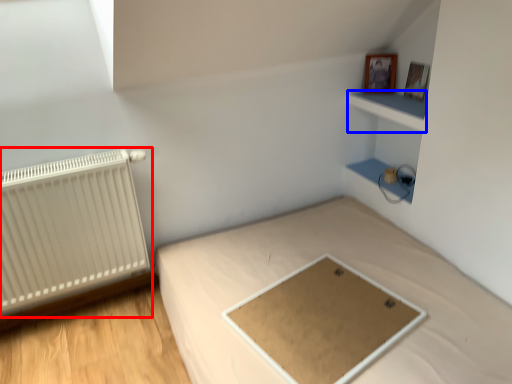
Question: Which object is closer to the camera taking this photo, radiator (highlighted by a red box) or cabinet (highlighted by a blue box)?

Choices:
 (A) radiator
 (B) cabinet

Answer: (A)